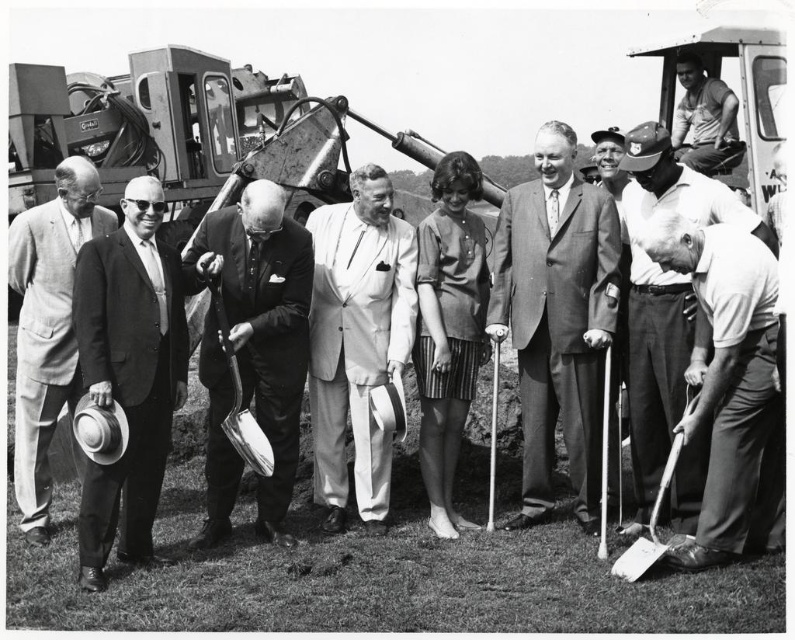
Question: Does shiny silver shovel at center have a greater width compared to smooth leather jacket at upper right?

Choices:
 (A) yes
 (B) no

Answer: (A)

Question: Estimate the real-world distances between objects in this image. Which object is farther from the white cotton shirt at lower right?

Choices:
 (A) light brown straw hat at left
 (B) striped fabric dress at center

Answer: (A)

Question: Does striped fabric dress at center have a larger size compared to smooth leather jacket at upper right?

Choices:
 (A) yes
 (B) no

Answer: (A)

Question: From the image, what is the correct spatial relationship of white cotton shirt at lower right in relation to smooth leather jacket at upper right?

Choices:
 (A) right
 (B) left

Answer: (B)

Question: Among these objects, which one is farthest from the camera?

Choices:
 (A) light gray suit at center
 (B) white cotton shirt at lower right
 (C) smooth suit at center
 (D) smooth leather jacket at upper right

Answer: (D)

Question: Considering the real-world distances, which object is closest to the striped fabric dress at center?

Choices:
 (A) smooth leather jacket at upper right
 (B) shiny silver shovel at center

Answer: (B)